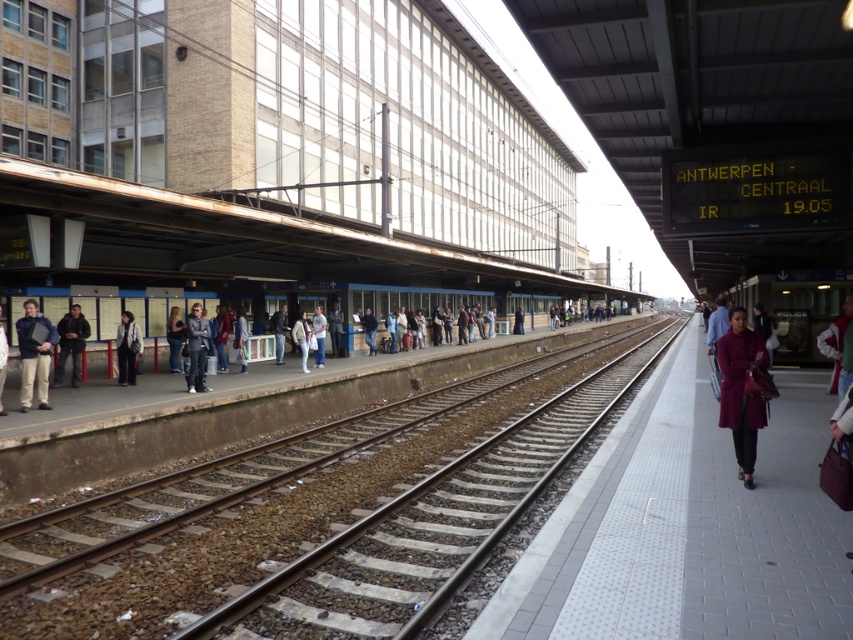
Is matte black jacket at left thinner than gray fabric jacket at center?

No.

Is point (21, 376) positioned behind point (189, 340)?

No, it is not.

Locate an element on the screen. matte black jacket at left is located at coordinates (33, 353).

Can you confirm if matte black jacket at left is positioned above dark gray fabric jacket at left?

Yes.

Is point (38, 339) behind point (123, 355)?

No, it is not.

Who is more distant from viewer, [28,300] or [128,328]?

Point [128,328]

You are a GUI agent. You are given a task and a screenshot of the screen. Output one action in this format:
    pyautogui.click(x=<x>, y=<y>)
    Task: Click on the matte black jacket at left
    The width and height of the screenshot is (853, 640).
    Given the screenshot: What is the action you would take?
    pyautogui.click(x=33, y=353)

Can you confirm if maroon coat at right is positioned above matte black jacket at left?

No, maroon coat at right is not above matte black jacket at left.

Is point (718, 348) positioned behind point (26, 339)?

No, (718, 348) is closer to viewer.

Based on the photo, who is more distant from viewer, (734, 340) or (25, 392)?

The point (25, 392) is more distant.

Identify the location of maroon coat at right. (741, 388).